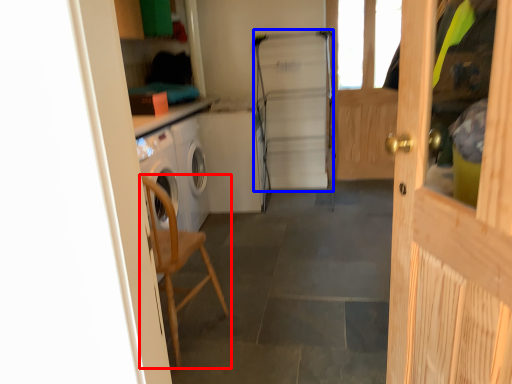
Question: Which object appears closest to the camera in this image, chair (highlighted by a red box) or fridge (highlighted by a blue box)?

Choices:
 (A) chair
 (B) fridge

Answer: (A)